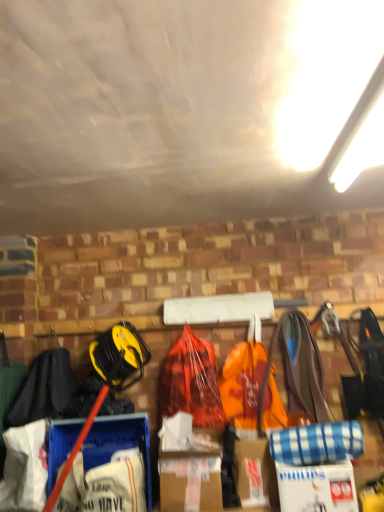
Question: Considering the positions of white cardboard box at lower right and orange plastic bag at center in the image, is white cardboard box at lower right bigger or smaller than orange plastic bag at center?

Choices:
 (A) big
 (B) small

Answer: (B)

Question: In terms of width, does white cardboard box at lower right look wider or thinner when compared to orange plastic bag at center?

Choices:
 (A) thin
 (B) wide

Answer: (B)

Question: Which of these objects is positioned closest to the black fabric at left?

Choices:
 (A) white cardboard box at lower right
 (B) orange plastic bag at center
 (C) orange plastic bag at center

Answer: (C)

Question: Which of these objects is positioned farthest from the white cardboard box at lower right?

Choices:
 (A) orange plastic bag at center
 (B) orange plastic bag at center
 (C) black fabric at left

Answer: (C)